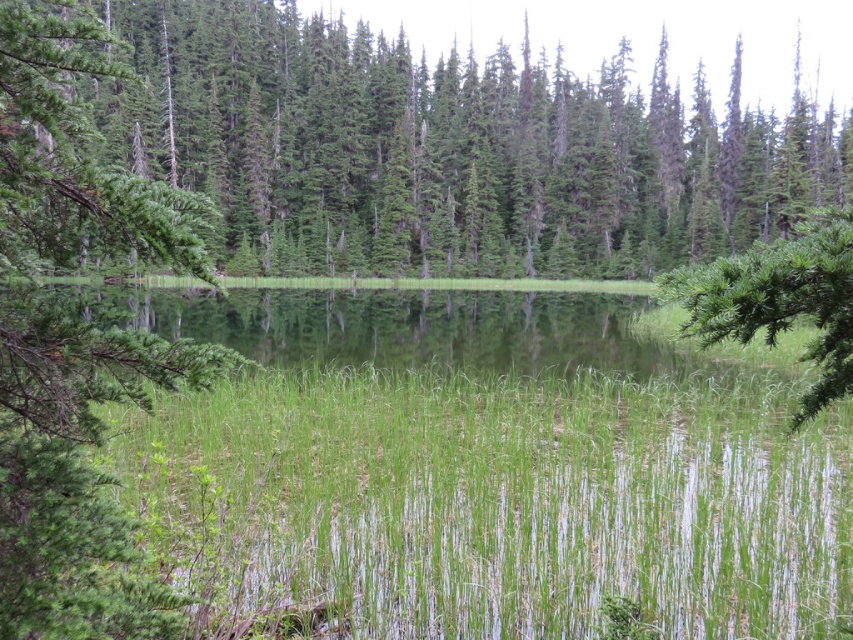
Question: Which point is farther to the camera?

Choices:
 (A) green matte tree at center
 (B) green grass at center

Answer: (B)

Question: Estimate the real-world distances between objects in this image. Which object is farther from the green grass at center?

Choices:
 (A) green needle-like at right
 (B) green leafy branch at left

Answer: (B)

Question: Can you confirm if green grass at center is positioned above green leafy branch at left?

Choices:
 (A) yes
 (B) no

Answer: (B)

Question: Does green matte tree at center have a larger size compared to green grass at center?

Choices:
 (A) no
 (B) yes

Answer: (B)

Question: Which of these objects is positioned farthest from the green needle-like at right?

Choices:
 (A) green grass at center
 (B) green leafy branch at left
 (C) green matte tree at center

Answer: (C)

Question: Is green matte tree at center to the right of green needle-like at right from the viewer's perspective?

Choices:
 (A) no
 (B) yes

Answer: (A)